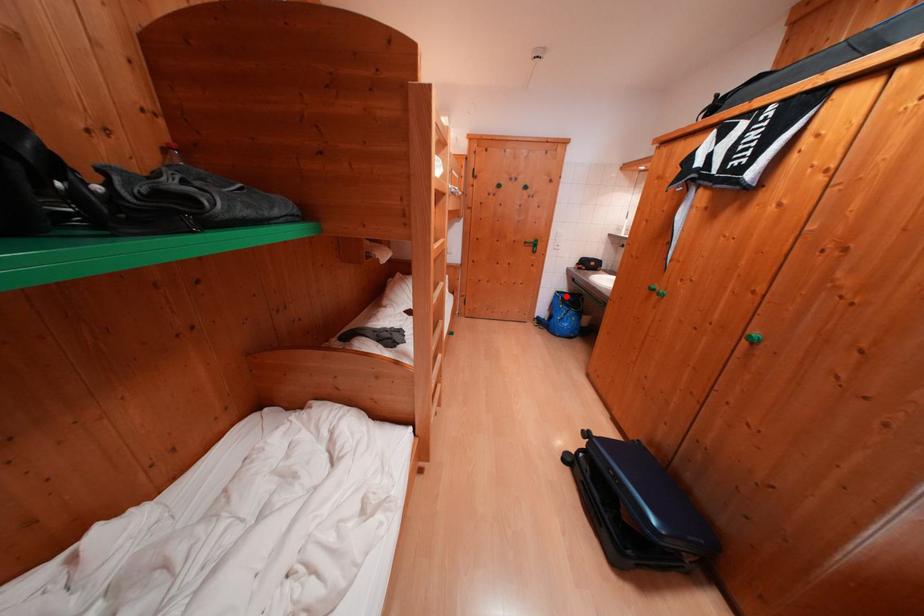
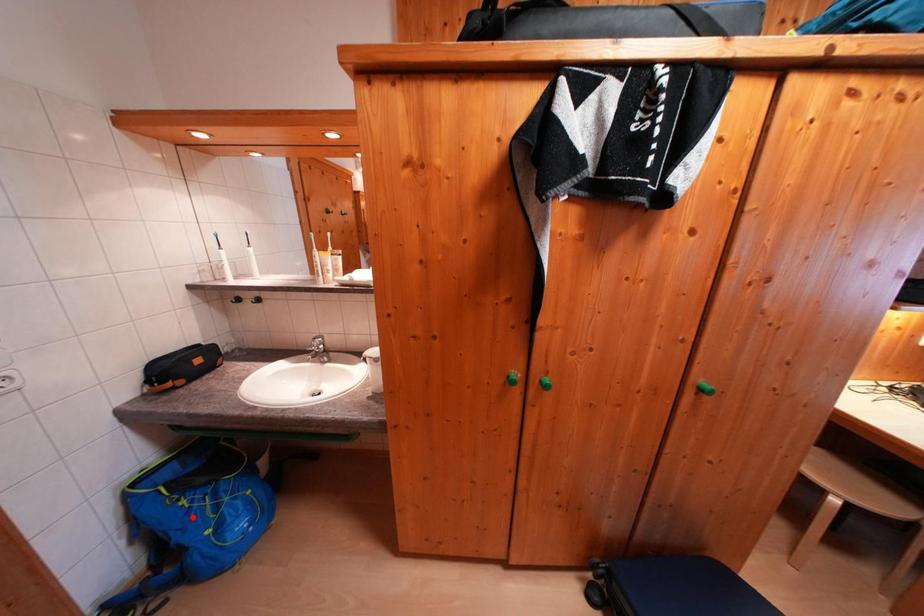
I am providing you with two images of the same scene from different viewpoints. A red point is marked on the first image and another point is marked on the second image. Is the marked point in image1 the same physical position as the marked point in image2?

No